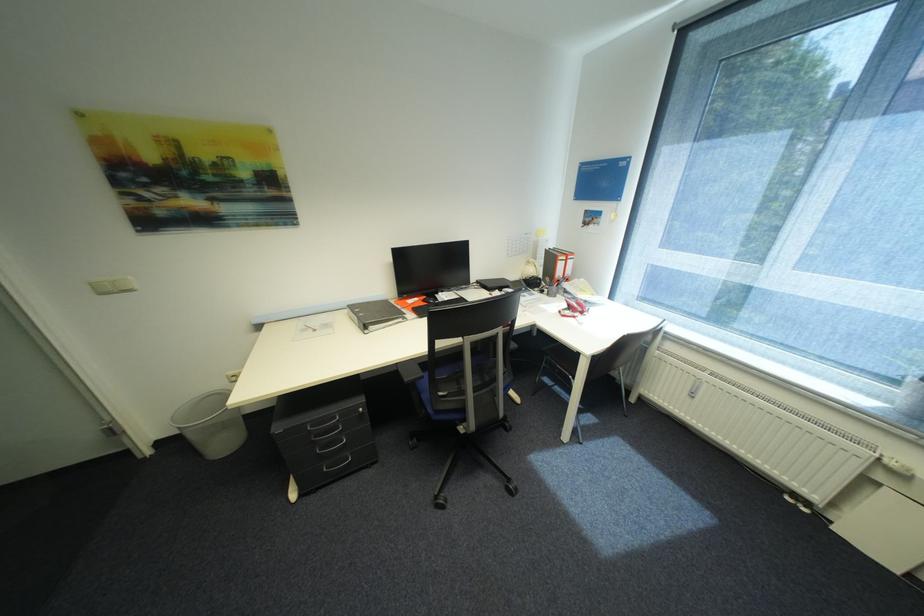
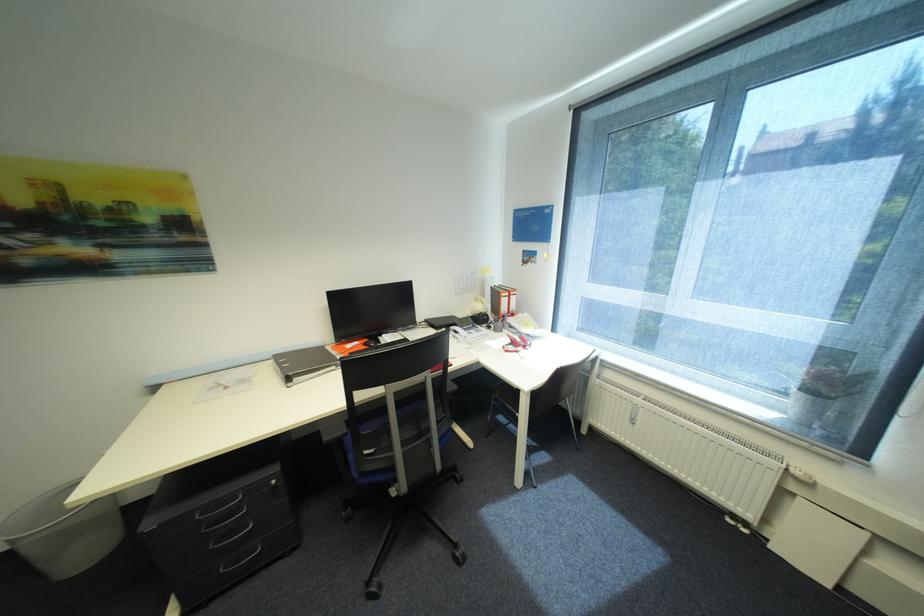
Where in the second image is the point corresponding to pixel 379 328 from the first image?

(304, 379)